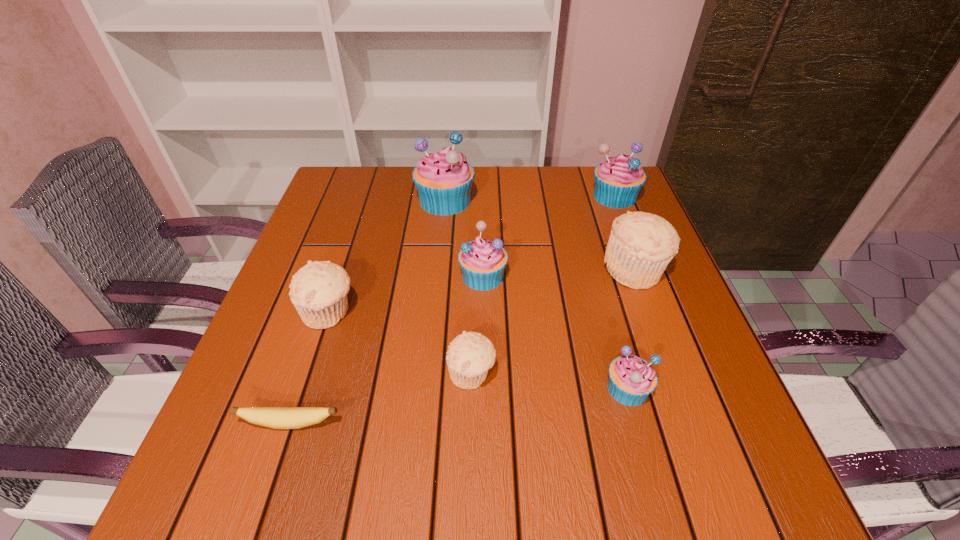
The width and height of the screenshot is (960, 540). I want to click on the tallest muffin, so click(443, 179).

Locate an element on the screen. This screenshot has width=960, height=540. the tallest object is located at coordinates (443, 179).

The height and width of the screenshot is (540, 960). I want to click on the rightmost blue muffin, so click(x=618, y=180).

Where is `the biggest beige muffin`? The height and width of the screenshot is (540, 960). the biggest beige muffin is located at coordinates (641, 245).

This screenshot has width=960, height=540. In order to click on the second nearest blue muffin in this screenshot , I will do (x=482, y=262).

Where is `the second biggest beige muffin`? The image size is (960, 540). the second biggest beige muffin is located at coordinates point(318,291).

Locate an element on the screen. The height and width of the screenshot is (540, 960). the leftmost beige muffin is located at coordinates (318, 291).

This screenshot has width=960, height=540. Find the location of `the smallest blue muffin`. the smallest blue muffin is located at coordinates (631, 379).

Locate an element on the screen. The image size is (960, 540). the second blue muffin from right to left is located at coordinates (631, 379).

This screenshot has height=540, width=960. I want to click on the second beige muffin from right to left, so click(x=470, y=355).